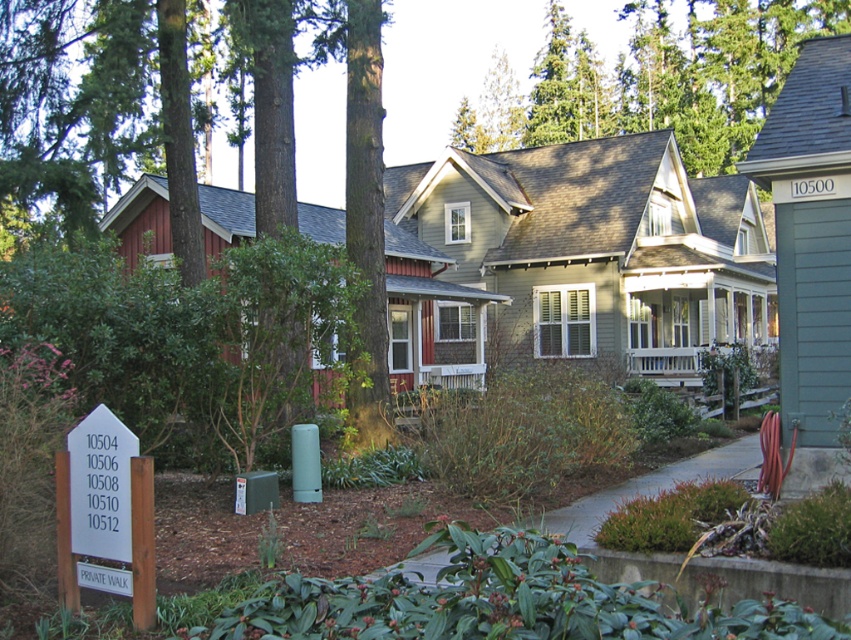
Question: From the image, what is the correct spatial relationship of green textured tree at upper center in relation to white plastic sign at lower left?

Choices:
 (A) right
 (B) left

Answer: (A)

Question: Is green rough bark tree at left positioned before white plastic sign at lower left?

Choices:
 (A) no
 (B) yes

Answer: (A)

Question: Which object appears farthest from the camera in this image?

Choices:
 (A) white wooden porch at center
 (B) green textured tree at upper center
 (C) green rough bark tree at left
 (D) white plastic sign at lower left

Answer: (B)

Question: Which point is closer to the camera?

Choices:
 (A) white plastic sign at lower left
 (B) white wooden porch at center
 (C) green textured tree at upper center
 (D) green rough bark tree at left

Answer: (A)

Question: Among these points, which one is nearest to the camera?

Choices:
 (A) (684, 124)
 (B) (52, 132)

Answer: (B)

Question: Does green rough bark tree at left appear on the left side of green textured tree at upper center?

Choices:
 (A) no
 (B) yes

Answer: (B)